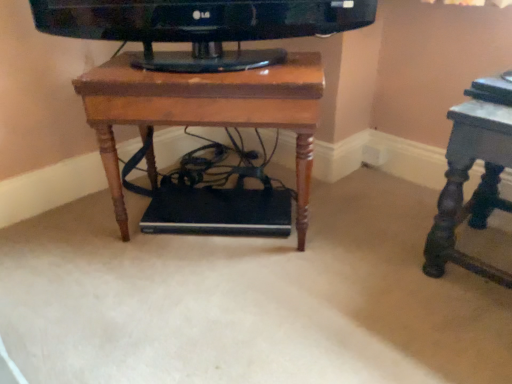
Find the location of `vacant space behind wooden table at center, arranged as the 2th table when viewed from the right`. vacant space behind wooden table at center, arranged as the 2th table when viewed from the right is located at coordinates (223, 165).